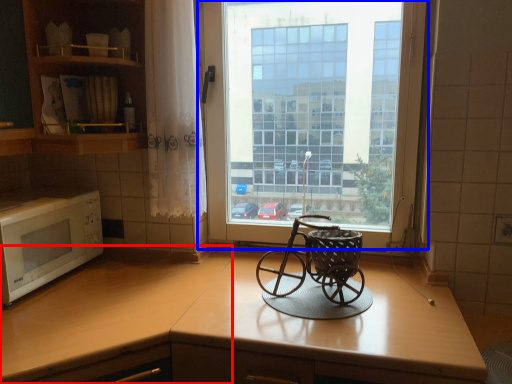
Question: Which of the following is the farthest to the observer, counter top (highlighted by a red box) or window (highlighted by a blue box)?

Choices:
 (A) counter top
 (B) window

Answer: (B)